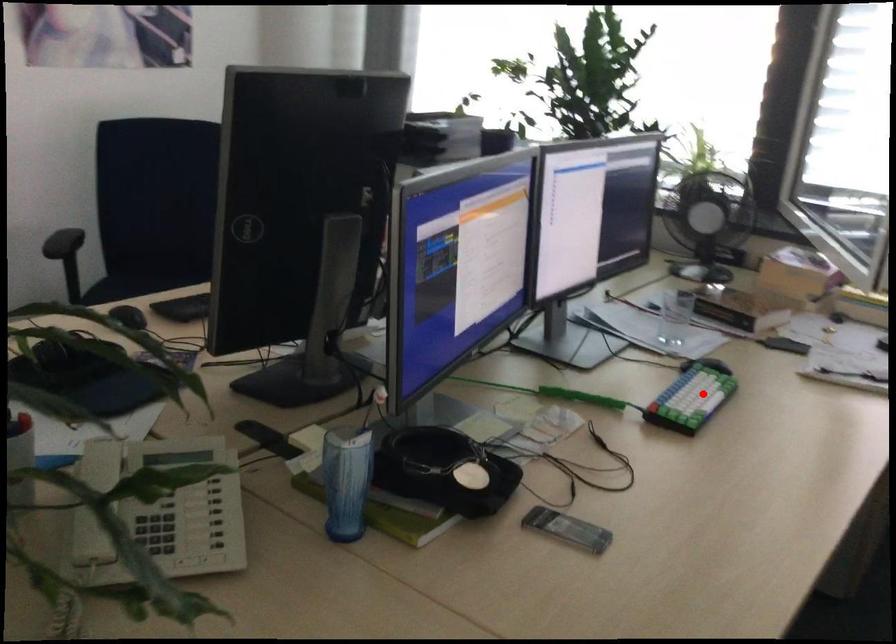
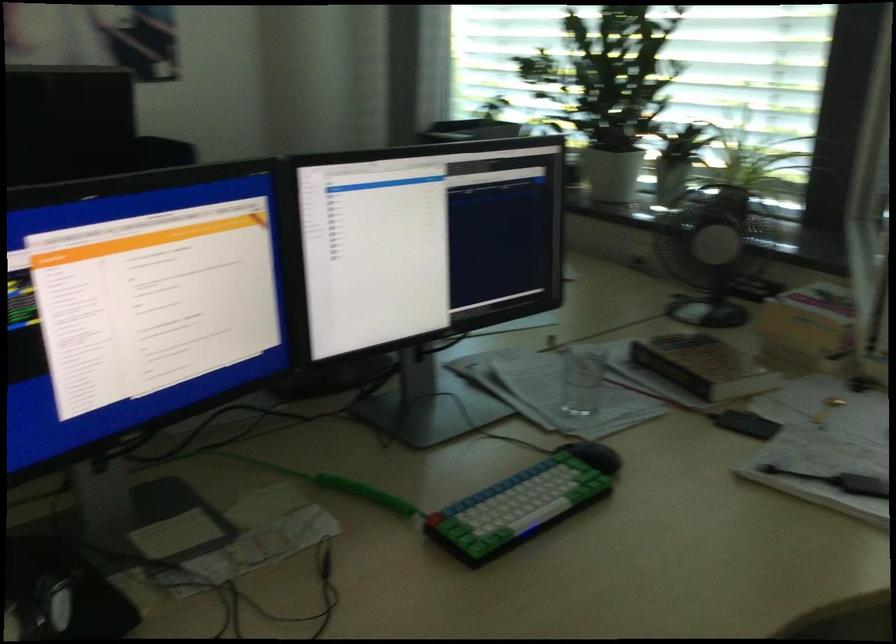
Question: I am providing you with two images of the same scene from different viewpoints. In image1, a red point is highlighted. Considering the same 3D point in image2, which of the following is correct?

Choices:
 (A) It is closer
 (B) It is farther

Answer: (A)